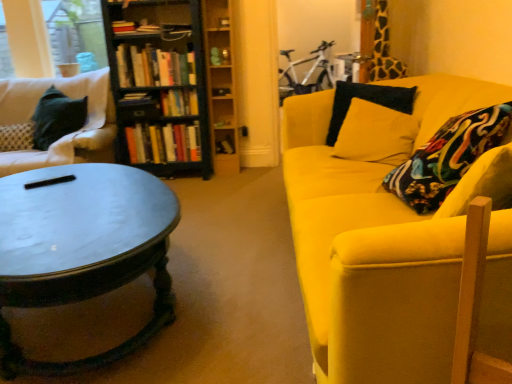
This screenshot has height=384, width=512. What do you see at coordinates (160, 86) in the screenshot?
I see `black wood bookcase at left` at bounding box center [160, 86].

The width and height of the screenshot is (512, 384). Describe the element at coordinates (154, 67) in the screenshot. I see `hardcover books at center, the fifth book positioned from the bottom` at that location.

Locate an element on the screen. The height and width of the screenshot is (384, 512). white metallic bicycle at upper center is located at coordinates (307, 72).

This screenshot has width=512, height=384. What do you see at coordinates (66, 135) in the screenshot? I see `white fabric couch at left, acting as the 1th studio couch starting from the left` at bounding box center [66, 135].

The image size is (512, 384). Describe the element at coordinates (387, 258) in the screenshot. I see `yellow fabric couch at right, which appears as the first studio couch when viewed from the right` at that location.

At what (x,y) coordinates should I click in order to perform the action: click on hardcover books at center, which is the 5th book from top to bottom. Please return your answer as a coordinate pair (x, y). Looking at the image, I should click on (163, 143).

From the image's perspective, is matte black coffee table at left beneath yellow fabric couch at right, the second studio couch viewed from the back?

Yes, from the image's perspective, matte black coffee table at left is below yellow fabric couch at right, the second studio couch viewed from the back.

Where is `coffee table behind the yellow fabric couch at right, which appears as the first studio couch when viewed from the right`? coffee table behind the yellow fabric couch at right, which appears as the first studio couch when viewed from the right is located at coordinates point(81,248).

In the image, is matte black coffee table at left on the left side or the right side of yellow fabric couch at right, acting as the 1th studio couch starting from the front?

matte black coffee table at left is positioned on yellow fabric couch at right, acting as the 1th studio couch starting from the front,'s left side.

Which object is thinner, matte black coffee table at left or yellow fabric couch at right, which appears as the first studio couch when viewed from the right?

matte black coffee table at left.

Is hardcover books at center, the fifth book positioned from the bottom, oriented away from hardcover book at upper left, the first book when ordered from top to bottom?

No, hardcover books at center, the fifth book positioned from the bottom, is not facing the opposite direction of hardcover book at upper left, the first book when ordered from top to bottom.

Looking at this image, can you confirm if hardcover books at center, marked as the second book in a top-to-bottom arrangement, is bigger than hardcover book at upper left, the first book when ordered from top to bottom?

Yes.

Locate an element on the screen. The image size is (512, 384). the 2nd book counting from the right side of the white fabric couch at left, which is the 2th studio couch in front-to-back order is located at coordinates (137, 99).

Which is in front, white fabric couch at left, which is the 2th studio couch in front-to-back order, or hardcover book at center, marked as the 4th book in a top-to-bottom arrangement?

Positioned in front is white fabric couch at left, which is the 2th studio couch in front-to-back order.

Looking at this image, does white fabric couch at left, which is the first studio couch in back-to-front order, have a smaller size compared to hardcover book at center, marked as the 4th book in a top-to-bottom arrangement?

Incorrect, white fabric couch at left, which is the first studio couch in back-to-front order, is not smaller in size than hardcover book at center, marked as the 4th book in a top-to-bottom arrangement.

Is wooden bookshelf at upper center, the 1th shelf viewed from the top, oriented towards white fabric couch at left, which is the 2th studio couch in front-to-back order?

No.

Is wooden bookshelf at upper center, positioned as the 2th shelf in bottom-to-top order, to the left or to the right of white fabric couch at left, which is the second studio couch from right to left, in the image?

wooden bookshelf at upper center, positioned as the 2th shelf in bottom-to-top order, is positioned on white fabric couch at left, which is the second studio couch from right to left,'s right side.

Identify the location of the 1st studio couch below the wooden bookshelf at upper center, the 1th shelf viewed from the top (from the image's perspective). (66, 135).

Does point (219, 12) come farther from viewer compared to point (77, 89)?

That is True.

Locate an element on the screen. pillow above the yellow fabric couch at right, which appears as the first studio couch when viewed from the right (from a real-world perspective) is located at coordinates (368, 101).

Does point (371, 86) lie in front of point (446, 256)?

No, it is not.

In the scene shown: Between black velvet pillow at upper right and yellow fabric couch at right, which appears as the first studio couch when viewed from the right, which one has larger size?

Bigger between the two is yellow fabric couch at right, which appears as the first studio couch when viewed from the right.

Considering the sizes of objects black velvet pillow at upper right and yellow fabric couch at right, which appears as the 2th studio couch when viewed from the left, in the image provided, who is taller, black velvet pillow at upper right or yellow fabric couch at right, which appears as the 2th studio couch when viewed from the left,?

Standing taller between the two is yellow fabric couch at right, which appears as the 2th studio couch when viewed from the left.

Is black wood bookcase at left closer to camera compared to hardcover book at center, positioned as the 3th book in bottom-to-top order?

Yes, it is.

From the image's perspective, is black wood bookcase at left positioned above or below hardcover book at center, positioned as the 3th book in bottom-to-top order?

Based on their image positions, black wood bookcase at left is located above hardcover book at center, positioned as the 3th book in bottom-to-top order.

Is black wood bookcase at left facing towards hardcover book at center, positioned as the 3th book in bottom-to-top order?

Yes, black wood bookcase at left faces towards hardcover book at center, positioned as the 3th book in bottom-to-top order.

Based on their sizes in the image, would you say black wood bookcase at left is bigger or smaller than hardcover book at center, positioned as the 3th book in bottom-to-top order?

Considering their sizes, black wood bookcase at left takes up more space than hardcover book at center, positioned as the 3th book in bottom-to-top order.

Considering the sizes of objects matte black coffee table at left and hardcover books at center, the fifth book positioned from the bottom, in the image provided, who is shorter, matte black coffee table at left or hardcover books at center, the fifth book positioned from the bottom,?

hardcover books at center, the fifth book positioned from the bottom.

Is matte black coffee table at left placed right next to hardcover books at center, the fifth book positioned from the bottom?

No, matte black coffee table at left is not touching hardcover books at center, the fifth book positioned from the bottom.

Considering the positions of point (144, 227) and point (176, 61), is point (144, 227) closer or farther from the camera than point (176, 61)?

Point (144, 227).

Image resolution: width=512 pixels, height=384 pixels. Identify the location of studio couch that is the 1st one above the matte black coffee table at left (from a real-world perspective). (387, 258).

Which book is the 2nd one when counting from the right side of the hardcover book at upper left, the first book when ordered from top to bottom? Please provide its 2D coordinates.

[(154, 67)]

When comparing their distances from hardcover book at center, the 6th book when ordered from top to bottom, does hardcover book at center, positioned as the 3th book in bottom-to-top order, or hardcover book at upper left, placed as the 6th book when sorted from bottom to top, seem further?

hardcover book at upper left, placed as the 6th book when sorted from bottom to top, is further to hardcover book at center, the 6th book when ordered from top to bottom.

Which object lies further to the anchor point hardcover book at center, marked as the 4th book in a top-to-bottom arrangement, white metallic bicycle at upper center or black velvet pillow at upper right?

black velvet pillow at upper right is positioned further to the anchor hardcover book at center, marked as the 4th book in a top-to-bottom arrangement.

Looking at the image, which one is located further to hardcover books at center, which is the 5th book from top to bottom, matte black coffee table at left or black velvet pillow at upper right?

matte black coffee table at left is positioned further to the anchor hardcover books at center, which is the 5th book from top to bottom.

Considering their positions, is hardcover book at center, which is the first book in bottom-to-top order, positioned further to black wood bookcase at left than hardcover book at center, the fourth book when ordered from bottom to top?

hardcover book at center, which is the first book in bottom-to-top order, is further to black wood bookcase at left.

Looking at the image, which one is located closer to matte black coffee table at left, hardcover book at center, the 6th book when ordered from top to bottom, or hardcover books at center, the fifth book positioned from the bottom?

The object closer to matte black coffee table at left is hardcover books at center, the fifth book positioned from the bottom.

Considering their positions, is matte black coffee table at left positioned closer to white metallic bicycle at upper center than black wood bookcase at left?

Based on the image, black wood bookcase at left appears to be nearer to white metallic bicycle at upper center.

Which object lies nearer to the anchor point white fabric couch at left, which is the 2th studio couch in front-to-back order, hardcover book at center, the fourth book when ordered from bottom to top, or hardcover book at center, positioned as the 3th book in bottom-to-top order?

hardcover book at center, positioned as the 3th book in bottom-to-top order, is closer to white fabric couch at left, which is the 2th studio couch in front-to-back order.

Estimate the real-world distances between objects in this image. Which object is further from hardcover books at center, marked as the second book in a top-to-bottom arrangement, yellow fabric couch at right, which appears as the first studio couch when viewed from the right, or white fabric couch at left, which is the 2th studio couch in front-to-back order?

yellow fabric couch at right, which appears as the first studio couch when viewed from the right, is positioned further to the anchor hardcover books at center, marked as the second book in a top-to-bottom arrangement.

The width and height of the screenshot is (512, 384). I want to click on bookcase between hardcover book at center, positioned as the 3th book in bottom-to-top order, and wooden bookshelf at upper center, the 1th shelf viewed from the top, so click(160, 86).

At what (x,y) coordinates should I click in order to perform the action: click on book positioned between matte black coffee table at left and wooden shelf at center, arranged as the 2th shelf when viewed from the top, from near to far. Please return your answer as a coordinate pair (x, y). Looking at the image, I should click on (123, 27).

Where is `window screen located between black wood bookcase at left and white metallic bicycle at upper center in the depth direction`? window screen located between black wood bookcase at left and white metallic bicycle at upper center in the depth direction is located at coordinates (75, 30).

Locate an element on the screen. The height and width of the screenshot is (384, 512). bookcase between hardcover books at center, the fifth book positioned from the bottom, and hardcover book at center, the 6th book when ordered from top to bottom, in the vertical direction is located at coordinates (160, 86).